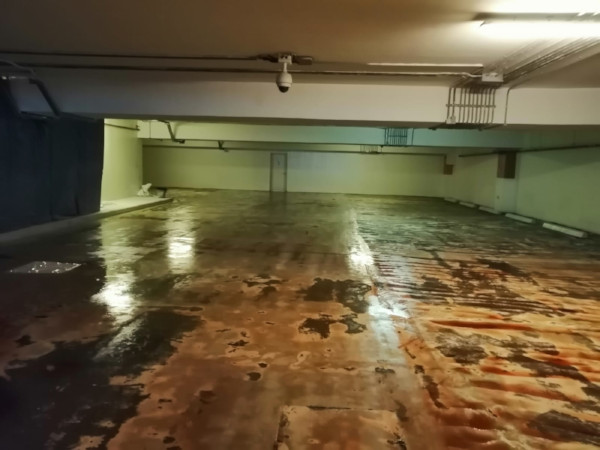
This screenshot has height=450, width=600. I want to click on wall corners, so click(441, 180), click(144, 167).